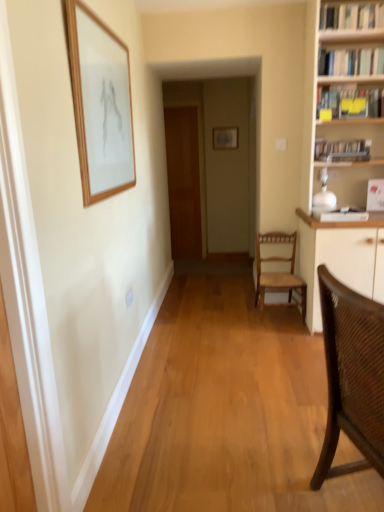
Where is `free space above hardcover books at upper right, positioned as the fourth book in top-to-bottom order (from a real-world perspective)`? free space above hardcover books at upper right, positioned as the fourth book in top-to-bottom order (from a real-world perspective) is located at coordinates (349, 133).